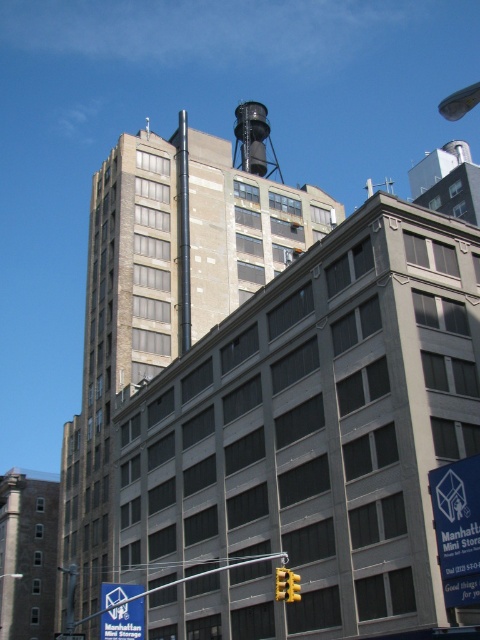
You are a drone operator trying to deliver a package to a specific location marked by the point coordinates. The scene shows a modern industrial building with a traffic light in front and an older building with a large vertical pipe in the background. You see a point at coordinates point (253,140). Which object in the scene is this point located on?

The point (253,140) is located on the black matte water tower at upper center.

You are a delivery driver approaching the two buildings. You need to locate the blue plastic street sign at center to make a turn. Which direction should you turn to face the black matte water tower at upper center?

The black matte water tower at upper center is to the right of the blue plastic street sign at center, so you should turn right to face it.